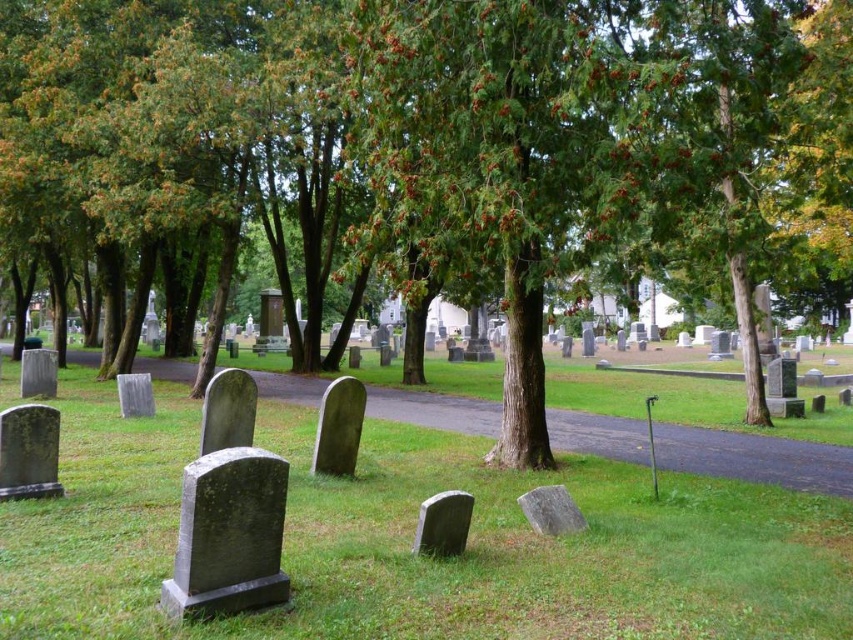
Question: Estimate the real-world distances between objects in this image. Which object is closer to the gray stone gravestone at center?

Choices:
 (A) green textured tree at center
 (B) smooth gray gravestone at lower left
 (C) gray stone gravestone at lower center

Answer: (B)

Question: Does dark gray stone gravestone at lower left have a greater width compared to gray stone gravestone at center?

Choices:
 (A) yes
 (B) no

Answer: (B)

Question: From the image, what is the correct spatial relationship of green grassy at center in relation to dark gray stone gravestone at lower left?

Choices:
 (A) right
 (B) left

Answer: (A)

Question: Considering the relative positions of smooth gray gravestone at center and gray stone gravestone at lower center in the image provided, where is smooth gray gravestone at center located with respect to gray stone gravestone at lower center?

Choices:
 (A) below
 (B) above

Answer: (B)

Question: Which object appears farthest from the camera in this image?

Choices:
 (A) black stone gravestone at lower left
 (B) green textured tree at center

Answer: (B)

Question: Which point is farther to the camera?

Choices:
 (A) (279, 500)
 (B) (136, 413)
 (C) (21, 360)

Answer: (C)